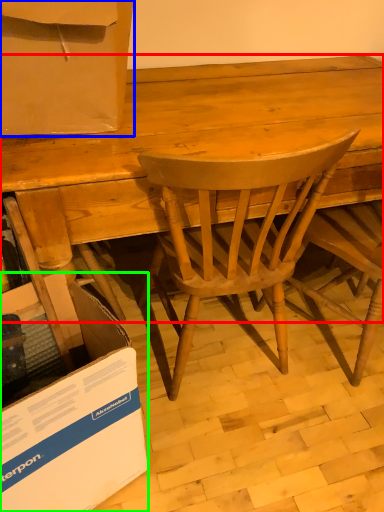
Question: Estimate the real-world distances between objects in this image. Which object is closer to desk (highlighted by a red box), box (highlighted by a blue box) or cardboard box (highlighted by a green box)?

Choices:
 (A) box
 (B) cardboard box

Answer: (A)